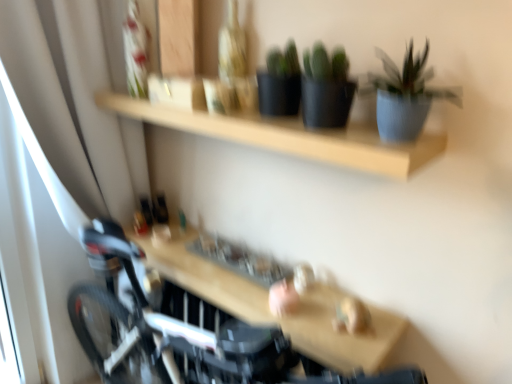
Find the location of a particular element. wooden shelf at center is located at coordinates (268, 306).

This screenshot has width=512, height=384. Describe the element at coordinates (268, 306) in the screenshot. I see `wooden shelf at center` at that location.

What is the approximate height of wooden shelf at center?

wooden shelf at center is 2.89 inches in height.

The image size is (512, 384). Describe the element at coordinates (405, 95) in the screenshot. I see `blue matte pot at upper right` at that location.

Image resolution: width=512 pixels, height=384 pixels. Identify the location of blue matte pot at upper right. 405,95.

Locate an element on the screen. wooden shelf at center is located at coordinates (268, 306).

Does blue matte pot at upper right appear on the right side of wooden shelf at center?

Indeed, blue matte pot at upper right is positioned on the right side of wooden shelf at center.

Based on the photo, is blue matte pot at upper right closer to the viewer compared to wooden shelf at center?

Yes, the depth of blue matte pot at upper right is less than that of wooden shelf at center.

Between point (370, 77) and point (269, 322), which one is positioned behind?

Point (269, 322)

From the image's perspective, does blue matte pot at upper right appear lower than wooden shelf at center?

No, from the image's perspective, blue matte pot at upper right is not beneath wooden shelf at center.

From a real-world perspective, between blue matte pot at upper right and wooden shelf at center, who is vertically lower?

wooden shelf at center, from a real-world perspective.

Which of these two, blue matte pot at upper right or wooden shelf at center, is wider?

wooden shelf at center is wider.

Can you confirm if blue matte pot at upper right is taller than wooden shelf at center?

Correct, blue matte pot at upper right is much taller as wooden shelf at center.

Is blue matte pot at upper right bigger or smaller than wooden shelf at center?

blue matte pot at upper right is smaller than wooden shelf at center.

Is blue matte pot at upper right surrounding wooden shelf at center?

No, wooden shelf at center is not inside blue matte pot at upper right.

Is there a large distance between blue matte pot at upper right and wooden shelf at center?

No, there isn't a large distance between blue matte pot at upper right and wooden shelf at center.

Is blue matte pot at upper right turned away from wooden shelf at center?

No, blue matte pot at upper right is not facing away from wooden shelf at center.

What's the angular difference between blue matte pot at upper right and wooden shelf at center's facing directions?

They differ by 3.18 degrees in their facing directions.

The height and width of the screenshot is (384, 512). Identify the location of houseplant located above the wooden shelf at center (from a real-world perspective). (405, 95).

Which object is positioned more to the left, wooden shelf at center or blue matte pot at upper right?

Positioned to the left is wooden shelf at center.

Which object is more forward, wooden shelf at center or blue matte pot at upper right?

blue matte pot at upper right is in front.

Considering the positions of point (261, 301) and point (388, 61), is point (261, 301) closer or farther from the camera than point (388, 61)?

Point (261, 301) is farther from the camera than point (388, 61).

From the image's perspective, would you say wooden shelf at center is positioned over blue matte pot at upper right?

Actually, wooden shelf at center appears below blue matte pot at upper right in the image.

From a real-world perspective, between wooden shelf at center and blue matte pot at upper right, who is vertically lower?

wooden shelf at center is physically lower.

Is wooden shelf at center thinner than blue matte pot at upper right?

Incorrect, the width of wooden shelf at center is not less than that of blue matte pot at upper right.

Is wooden shelf at center taller or shorter than blue matte pot at upper right?

Considering their sizes, wooden shelf at center has less height than blue matte pot at upper right.

Considering the sizes of wooden shelf at center and blue matte pot at upper right in the image, is wooden shelf at center bigger or smaller than blue matte pot at upper right?

Clearly, wooden shelf at center is larger in size than blue matte pot at upper right.

Is wooden shelf at center completely or partially outside of blue matte pot at upper right?

Yes, wooden shelf at center is not within blue matte pot at upper right.

Is wooden shelf at center positioned far away from blue matte pot at upper right?

No, wooden shelf at center is not far from blue matte pot at upper right.

Could you tell me if wooden shelf at center is facing blue matte pot at upper right?

No, wooden shelf at center is not turned towards blue matte pot at upper right.

Find the location of a particular element. Image resolution: width=512 pixels, height=384 pixels. houseplant that is in front of the wooden shelf at center is located at coordinates (405, 95).

Where is `houseplant in front of the wooden shelf at center`? This screenshot has height=384, width=512. houseplant in front of the wooden shelf at center is located at coordinates (405, 95).

Where is `table behind the blue matte pot at upper right`? The image size is (512, 384). table behind the blue matte pot at upper right is located at coordinates (268, 306).